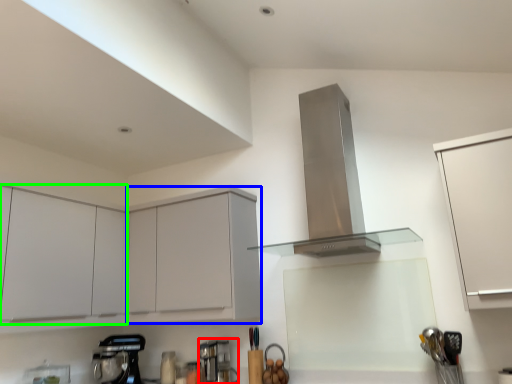
Question: Which object is the farthest from coffee machine (highlighted by a red box)? Choose among these: cabinetry (highlighted by a blue box) or cabinetry (highlighted by a green box).

Choices:
 (A) cabinetry
 (B) cabinetry

Answer: (B)